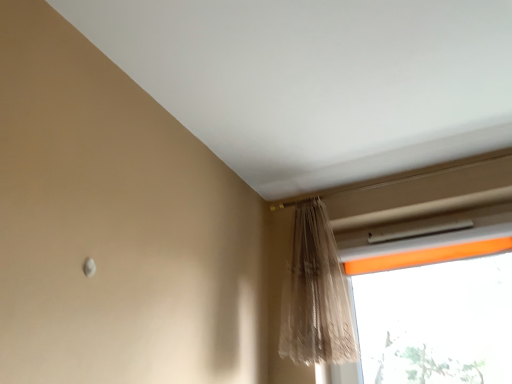
Question: From the image's perspective, is orange fabric window at upper right beneath sheer beige curtain at upper right?

Choices:
 (A) yes
 (B) no

Answer: (A)

Question: Is orange fabric window at upper right oriented away from sheer beige curtain at upper right?

Choices:
 (A) yes
 (B) no

Answer: (B)

Question: Does orange fabric window at upper right have a smaller size compared to sheer beige curtain at upper right?

Choices:
 (A) no
 (B) yes

Answer: (B)

Question: Can you confirm if orange fabric window at upper right is shorter than sheer beige curtain at upper right?

Choices:
 (A) yes
 (B) no

Answer: (A)

Question: Is orange fabric window at upper right further to camera compared to sheer beige curtain at upper right?

Choices:
 (A) no
 (B) yes

Answer: (B)

Question: Is orange fabric window at upper right taller than sheer beige curtain at upper right?

Choices:
 (A) no
 (B) yes

Answer: (A)

Question: Is sheer beige curtain at upper right oriented away from orange fabric window at upper right?

Choices:
 (A) no
 (B) yes

Answer: (B)

Question: Is sheer beige curtain at upper right next to orange fabric window at upper right?

Choices:
 (A) no
 (B) yes

Answer: (A)

Question: Can you confirm if sheer beige curtain at upper right is bigger than orange fabric window at upper right?

Choices:
 (A) no
 (B) yes

Answer: (B)

Question: Is sheer beige curtain at upper right not inside orange fabric window at upper right?

Choices:
 (A) no
 (B) yes

Answer: (B)

Question: Is sheer beige curtain at upper right far from orange fabric window at upper right?

Choices:
 (A) no
 (B) yes

Answer: (A)

Question: Can you confirm if sheer beige curtain at upper right is positioned to the right of orange fabric window at upper right?

Choices:
 (A) yes
 (B) no

Answer: (B)

Question: Relative to sheer beige curtain at upper right, is orange fabric window at upper right in front or behind?

Choices:
 (A) behind
 (B) front

Answer: (A)